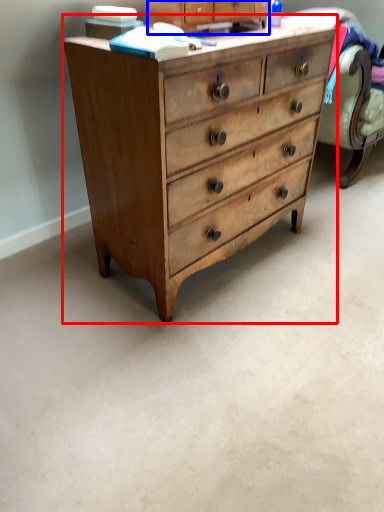
Question: Which object appears farthest to the camera in this image, chest of drawers (highlighted by a red box) or cabinetry (highlighted by a blue box)?

Choices:
 (A) chest of drawers
 (B) cabinetry

Answer: (B)